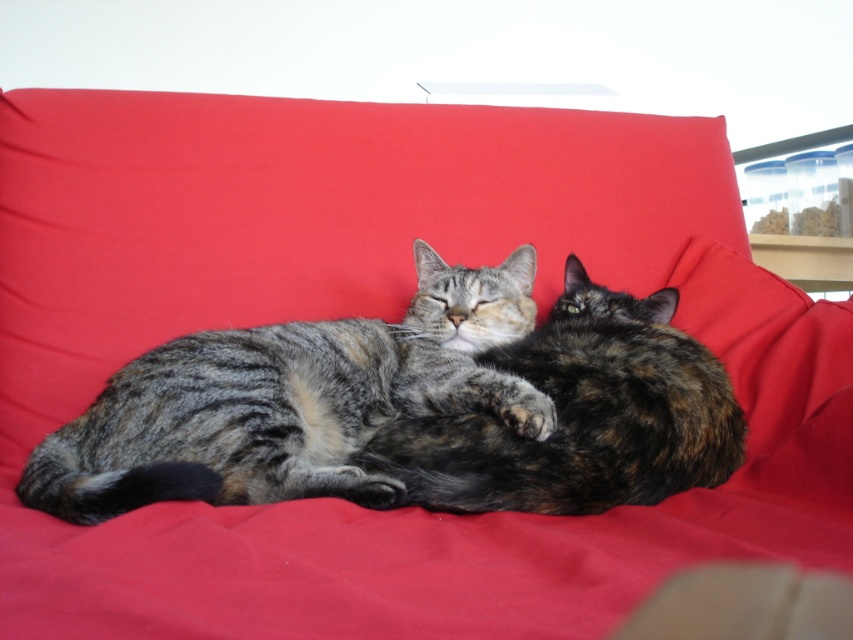
Who is positioned more to the right, gray tabby cat at center or tabby fur cat at center?

tabby fur cat at center is more to the right.

Who is more forward, [125,406] or [643,433]?

Point [643,433]

Measure the distance between point [247,488] and camera.

84.87 centimeters

I want to click on gray tabby cat at center, so click(291, 401).